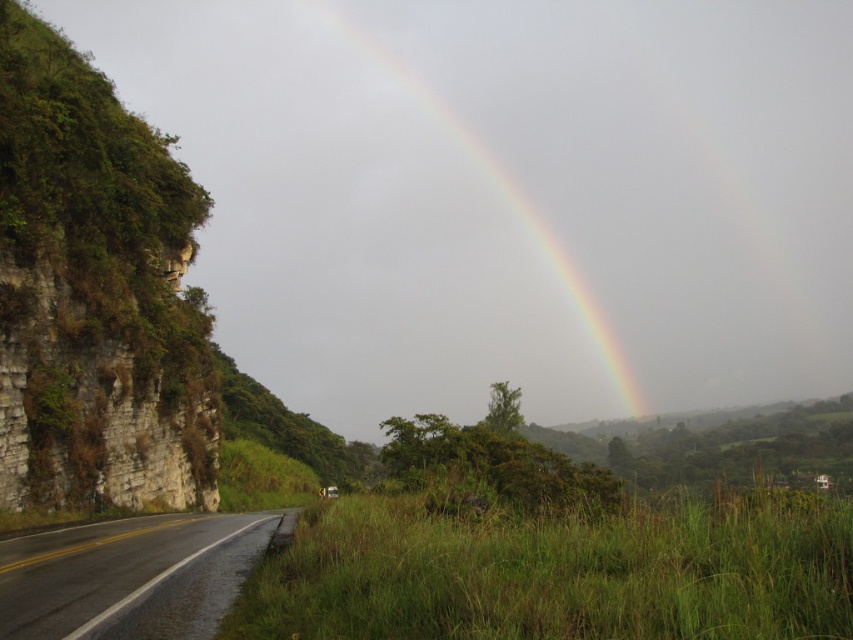
Between rocky cliff at left and black asphalt road at lower left, which one is positioned lower?

Positioned lower is black asphalt road at lower left.

Locate an element on the screen. The height and width of the screenshot is (640, 853). rocky cliff at left is located at coordinates (96, 292).

Identify the location of rocky cliff at left. (96, 292).

Between black asphalt road at lower left and rainbow at upper center, which one appears on the left side from the viewer's perspective?

From the viewer's perspective, black asphalt road at lower left appears more on the left side.

Does black asphalt road at lower left have a lesser width compared to rainbow at upper center?

Correct, black asphalt road at lower left's width is less than rainbow at upper center's.

What do you see at coordinates (129, 577) in the screenshot?
I see `black asphalt road at lower left` at bounding box center [129, 577].

At what (x,y) coordinates should I click in order to perform the action: click on black asphalt road at lower left. Please return your answer as a coordinate pair (x, y). The height and width of the screenshot is (640, 853). Looking at the image, I should click on (129, 577).

Image resolution: width=853 pixels, height=640 pixels. Describe the element at coordinates (96, 292) in the screenshot. I see `rocky cliff at left` at that location.

Is point (172, 461) behind point (525, 221)?

No.

You are a GUI agent. You are given a task and a screenshot of the screen. Output one action in this format:
    pyautogui.click(x=<x>, y=<y>)
    Task: Click on the rocky cliff at left
    Image resolution: width=853 pixels, height=640 pixels.
    Given the screenshot: What is the action you would take?
    pyautogui.click(x=96, y=292)